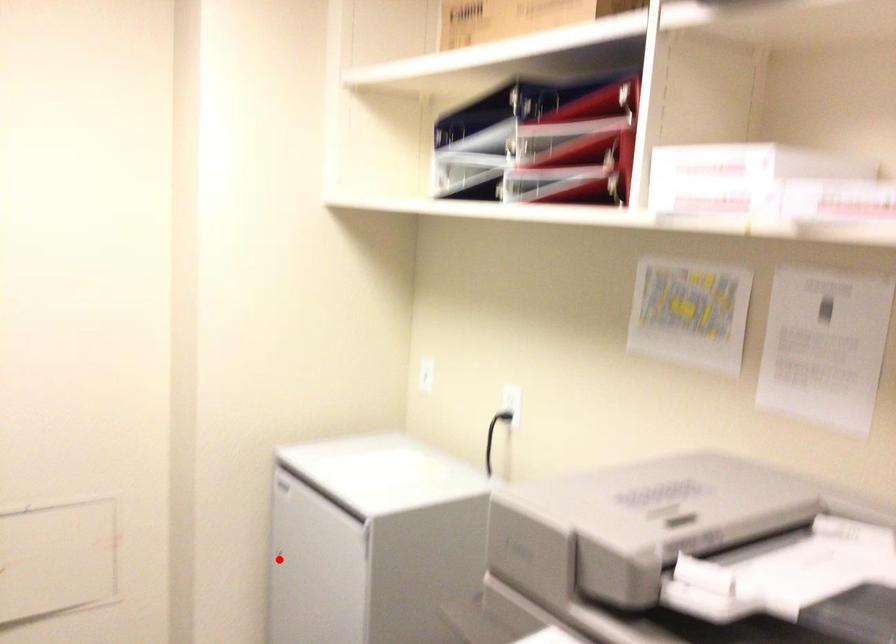
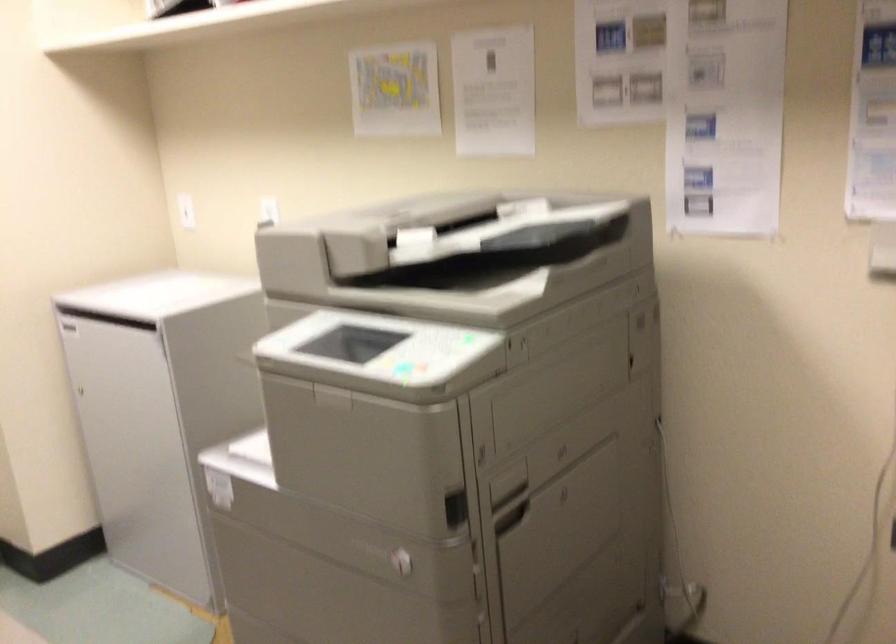
Locate, in the second image, the point that corresponds to the highlighted location in the first image.

(85, 392)